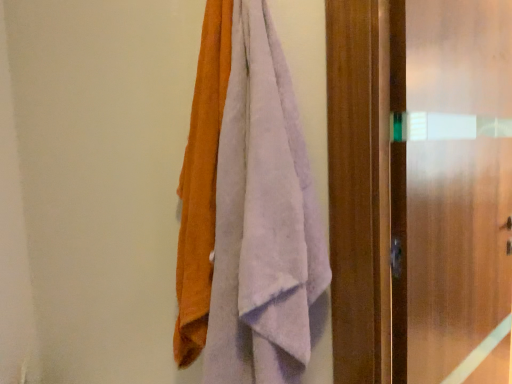
What do you see at coordinates (451, 190) in the screenshot? I see `frosted glass screen door at right` at bounding box center [451, 190].

What is the approximate width of frosted glass screen door at right?

12.02 centimeters.

Find the location of a particular element. frosted glass screen door at right is located at coordinates (451, 190).

The height and width of the screenshot is (384, 512). Describe the element at coordinates (265, 224) in the screenshot. I see `soft cotton towels at center` at that location.

You are a GUI agent. You are given a task and a screenshot of the screen. Output one action in this format:
    pyautogui.click(x=<x>, y=<y>)
    Task: Click on the soft cotton towels at center
    Image resolution: width=512 pixels, height=384 pixels.
    Given the screenshot: What is the action you would take?
    pyautogui.click(x=265, y=224)

Image resolution: width=512 pixels, height=384 pixels. Find the location of `frosted glass screen door at right`. frosted glass screen door at right is located at coordinates (451, 190).

Does soft cotton towels at center appear on the left side of frosted glass screen door at right?

Correct, you'll find soft cotton towels at center to the left of frosted glass screen door at right.

Which is in front, soft cotton towels at center or frosted glass screen door at right?

soft cotton towels at center is in front.

Does point (295, 211) come behind point (477, 148)?

No, it is in front of (477, 148).

From the image's perspective, would you say soft cotton towels at center is positioned over frosted glass screen door at right?

Yes.

From a real-world perspective, is soft cotton towels at center positioned under frosted glass screen door at right based on gravity?

Actually, soft cotton towels at center is physically above frosted glass screen door at right in the real world.

Is soft cotton towels at center thinner than frosted glass screen door at right?

No.

In the scene shown: Can you confirm if soft cotton towels at center is taller than frosted glass screen door at right?

In fact, soft cotton towels at center may be shorter than frosted glass screen door at right.

Considering the sizes of objects soft cotton towels at center and frosted glass screen door at right in the image provided, who is smaller, soft cotton towels at center or frosted glass screen door at right?

soft cotton towels at center.

Could frosted glass screen door at right be considered to be inside soft cotton towels at center?

No.

Are soft cotton towels at center and frosted glass screen door at right located far from each other?

They are positioned close to each other.

Is frosted glass screen door at right at the back of soft cotton towels at center?

No, soft cotton towels at center's orientation is not away from frosted glass screen door at right.

Identify the location of screen door on the right of the soft cotton towels at center. (451, 190).

Consider the image. Between frosted glass screen door at right and soft cotton towels at center, which one appears on the right side from the viewer's perspective?

frosted glass screen door at right.

From the picture: Is frosted glass screen door at right closer to the viewer compared to soft cotton towels at center?

No.

Which is nearer, [487,43] or [312,122]?

The point [312,122] is more forward.

From the image's perspective, is frosted glass screen door at right on soft cotton towels at center?

No.

From a real-world perspective, between frosted glass screen door at right and soft cotton towels at center, who is vertically lower?

frosted glass screen door at right is physically lower.

Which object is thinner, frosted glass screen door at right or soft cotton towels at center?

Thinner between the two is frosted glass screen door at right.

Consider the image. Between frosted glass screen door at right and soft cotton towels at center, which one has more height?

Standing taller between the two is frosted glass screen door at right.

Between frosted glass screen door at right and soft cotton towels at center, which one has smaller size?

soft cotton towels at center is smaller.

Do you think frosted glass screen door at right is within soft cotton towels at center, or outside of it?

frosted glass screen door at right is spatially situated outside soft cotton towels at center.

Is frosted glass screen door at right beside soft cotton towels at center?

No, frosted glass screen door at right is not beside soft cotton towels at center.

Does frosted glass screen door at right turn towards soft cotton towels at center?

No.

How much distance is there between frosted glass screen door at right and soft cotton towels at center?

frosted glass screen door at right and soft cotton towels at center are 18.49 inches apart from each other.

Locate an element on the screen. The width and height of the screenshot is (512, 384). towel above the frosted glass screen door at right (from a real-world perspective) is located at coordinates (265, 224).

At what (x,y) coordinates should I click in order to perform the action: click on towel that is on the left side of frosted glass screen door at right. Please return your answer as a coordinate pair (x, y). Image resolution: width=512 pixels, height=384 pixels. Looking at the image, I should click on (265, 224).

Find the location of a particular element. The height and width of the screenshot is (384, 512). towel that appears in front of the frosted glass screen door at right is located at coordinates (265, 224).